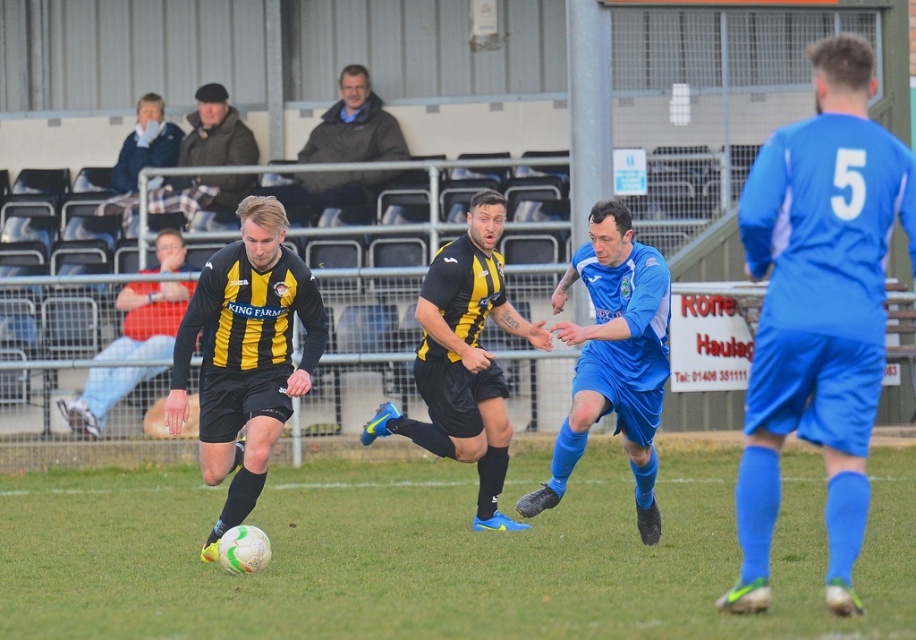
Question: Does green grass at center appear on the right side of blue denim jacket at upper left?

Choices:
 (A) no
 (B) yes

Answer: (B)

Question: Which point is farther to the camera?

Choices:
 (A) (253, 186)
 (B) (322, 129)
 (C) (462, 296)

Answer: (B)

Question: Which of the following is the closest to the observer?

Choices:
 (A) [165, 268]
 (B) [582, 250]
 (C) [484, 356]

Answer: (B)

Question: Can you confirm if black/yellow striped jersey at center is thinner than dark brown leather jacket at upper center?

Choices:
 (A) no
 (B) yes

Answer: (B)

Question: Observing the image, what is the correct spatial positioning of black/yellow striped jersey at center in reference to yellow-black jersey at center?

Choices:
 (A) above
 (B) below

Answer: (B)

Question: Which point is farther from the camera taking this photo?

Choices:
 (A) [562, 476]
 (B) [128, 216]
 (C) [481, 420]
 (D) [390, 636]

Answer: (B)